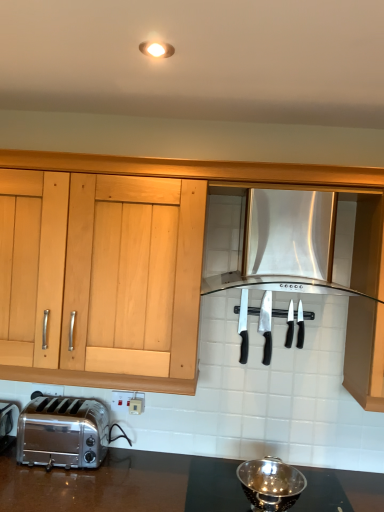
Question: From the image's perspective, is silver metallic knife at center, the 4th silverware from the right, located beneath metallic reflective colander at lower center?

Choices:
 (A) no
 (B) yes

Answer: (A)

Question: Does silver metallic knife at center, the 4th silverware from the right, have a lesser height compared to metallic reflective colander at lower center?

Choices:
 (A) no
 (B) yes

Answer: (A)

Question: Would you consider silver metallic knife at center, which ranks as the first silverware in left-to-right order, to be distant from metallic reflective colander at lower center?

Choices:
 (A) yes
 (B) no

Answer: (B)

Question: Is silver metallic knife at center, the 4th silverware from the right, outside of metallic reflective colander at lower center?

Choices:
 (A) no
 (B) yes

Answer: (B)

Question: Is metallic reflective colander at lower center at the back of silver metallic knife at center, the 4th silverware from the right?

Choices:
 (A) no
 (B) yes

Answer: (A)

Question: Considering the relative sizes of silver metallic knife at center, which ranks as the first silverware in left-to-right order, and metallic reflective colander at lower center in the image provided, is silver metallic knife at center, which ranks as the first silverware in left-to-right order, wider than metallic reflective colander at lower center?

Choices:
 (A) no
 (B) yes

Answer: (A)

Question: Is black plastic knives at center, arranged as the 4th silverware when viewed from the left, directly adjacent to satin silver toaster at lower left?

Choices:
 (A) no
 (B) yes

Answer: (A)

Question: Does black plastic knives at center, arranged as the 4th silverware when viewed from the left, have a lesser width compared to satin silver toaster at lower left?

Choices:
 (A) no
 (B) yes

Answer: (B)

Question: Is black plastic knives at center, marked as the first silverware in a right-to-left arrangement, aimed at satin silver toaster at lower left?

Choices:
 (A) no
 (B) yes

Answer: (A)

Question: From a real-world perspective, is black plastic knives at center, arranged as the 4th silverware when viewed from the left, over satin silver toaster at lower left?

Choices:
 (A) yes
 (B) no

Answer: (A)

Question: Considering the relative sizes of black plastic knives at center, marked as the first silverware in a right-to-left arrangement, and satin silver toaster at lower left in the image provided, is black plastic knives at center, marked as the first silverware in a right-to-left arrangement, wider than satin silver toaster at lower left?

Choices:
 (A) no
 (B) yes

Answer: (A)

Question: Is black plastic knives at center, marked as the first silverware in a right-to-left arrangement, oriented away from satin silver toaster at lower left?

Choices:
 (A) no
 (B) yes

Answer: (A)

Question: Does polished stainless steel knife at center, which is counted as the 3th silverware, starting from the right, have a greater width compared to black plastic knives at center, placed as the second silverware when sorted from right to left?

Choices:
 (A) no
 (B) yes

Answer: (B)